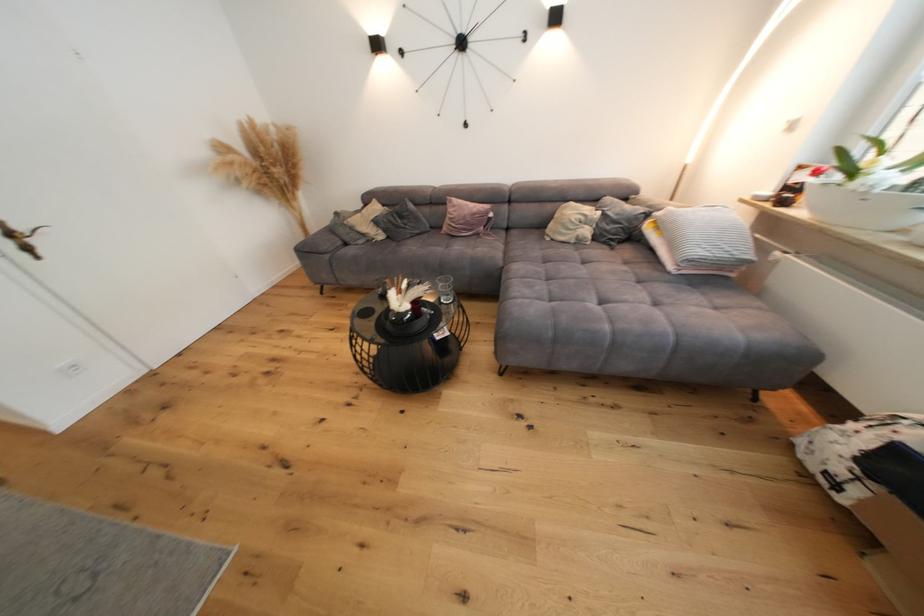
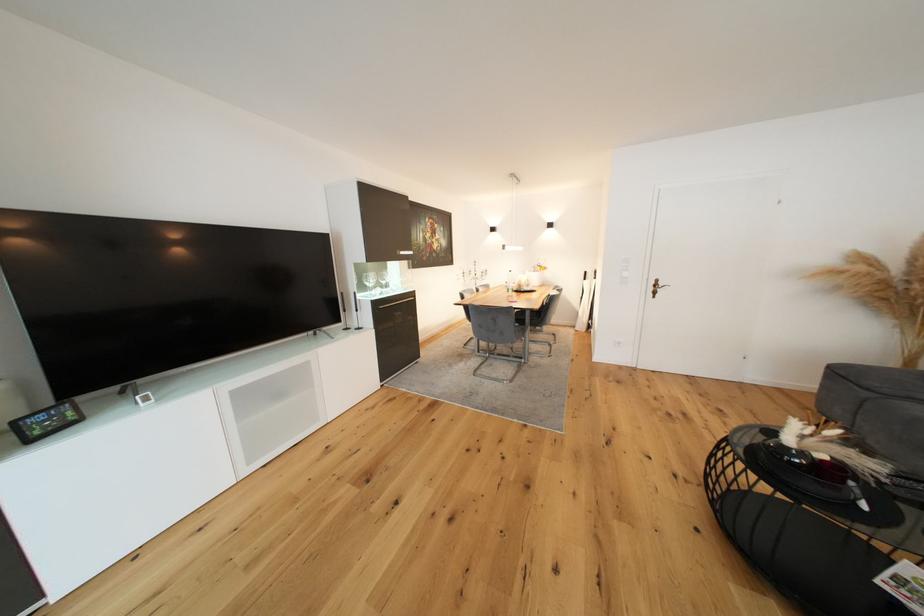
In the second image, find the point that corresponds to the point at 26,230 in the first image.

(667, 286)